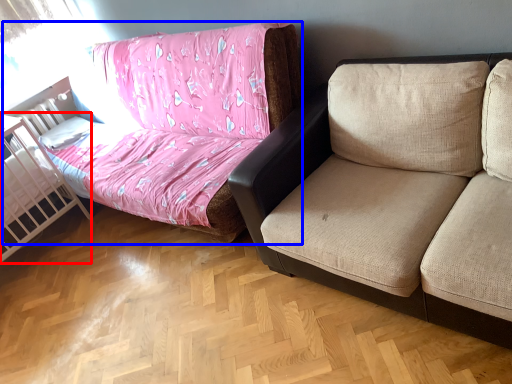
Question: Among these objects, which one is nearest to the camera, infant bed (highlighted by a red box) or studio couch (highlighted by a blue box)?

Choices:
 (A) infant bed
 (B) studio couch

Answer: (B)